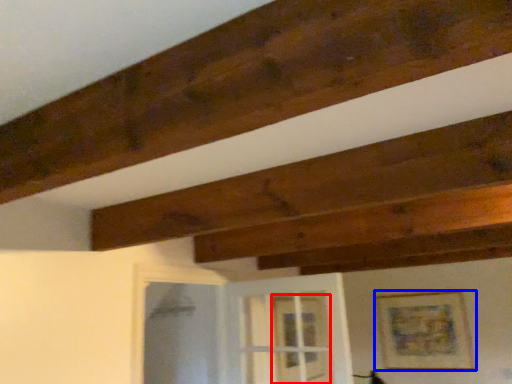
Question: Which object is further to the camera taking this photo, glass door (highlighted by a red box) or picture frame (highlighted by a blue box)?

Choices:
 (A) glass door
 (B) picture frame

Answer: (B)